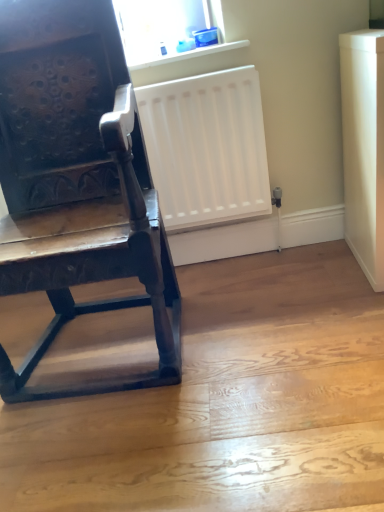
Where is `vacant area situated below dark wood chair at left (from a real-world perspective)`? The width and height of the screenshot is (384, 512). vacant area situated below dark wood chair at left (from a real-world perspective) is located at coordinates (109, 328).